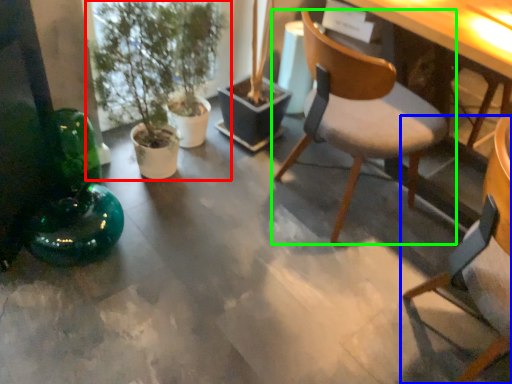
Question: Which object is the closest to the houseplant (highlighted by a red box)? Choose among these: chair (highlighted by a blue box) or chair (highlighted by a green box).

Choices:
 (A) chair
 (B) chair

Answer: (B)